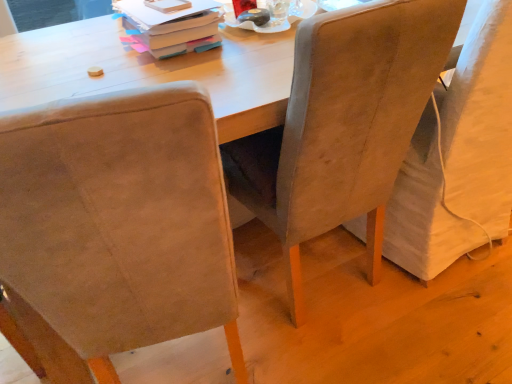
The height and width of the screenshot is (384, 512). Identify the location of vacant region in front of suede-like beige chair at right, which ranks as the third chair in left-to-right order. (439, 331).